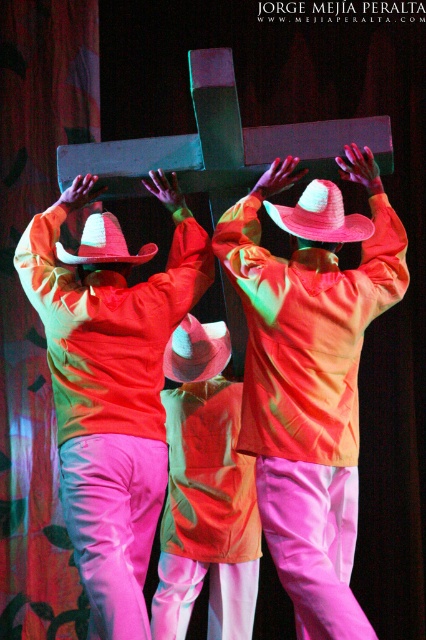
You are a costume designer preparing for a performance. You need to ensure that the pink satin pants at center and the white felt cowboy hat at center are displayed properly in the showcase. Which item has a greater width when viewed from the front?

The pink satin pants at center has a greater width than the white felt cowboy hat at center according to the description provided.

You are standing at the point marked as point (x=86, y=504). There are three performers holding a large cross. How far apart are the performers from each other?

The three performers are 3.01 meters apart from each other.

You are an event photographer who needs to capture a closeup shot of the pink satin hat at upper center. The camera has a focal length of 100mm and the subject is 10 meters away. What is the approximate angle of view required to frame the hat perfectly?

The pink satin hat at upper center is positioned at coordinates point (310, 378). To calculate the angle of view, use the formula angle of view in degrees equals 57 times the sensor size divided by the focal length. However, without knowing the sensor size, it is impossible to determine the exact angle of view. Please provide more information about the camera sensor size.